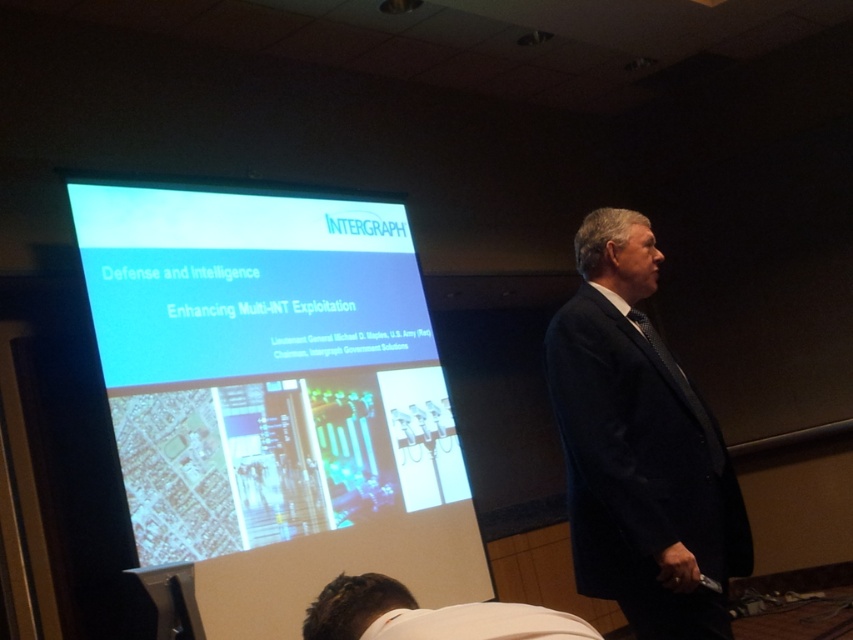
Question: Which object is positioned closest to the white glossy projector screen at upper center?

Choices:
 (A) black suit at center
 (B) white fabric shirt at lower center

Answer: (A)

Question: Can you confirm if white glossy projector screen at upper center is wider than white fabric shirt at lower center?

Choices:
 (A) yes
 (B) no

Answer: (A)

Question: Does white glossy projector screen at upper center appear under black suit at center?

Choices:
 (A) no
 (B) yes

Answer: (A)

Question: Which point is closer to the camera?

Choices:
 (A) (657, 451)
 (B) (537, 616)
 (C) (358, 244)

Answer: (B)

Question: Among these objects, which one is farthest from the camera?

Choices:
 (A) white fabric shirt at lower center
 (B) white glossy projector screen at upper center
 (C) black suit at center

Answer: (B)

Question: Does white glossy projector screen at upper center lie behind white fabric shirt at lower center?

Choices:
 (A) yes
 (B) no

Answer: (A)